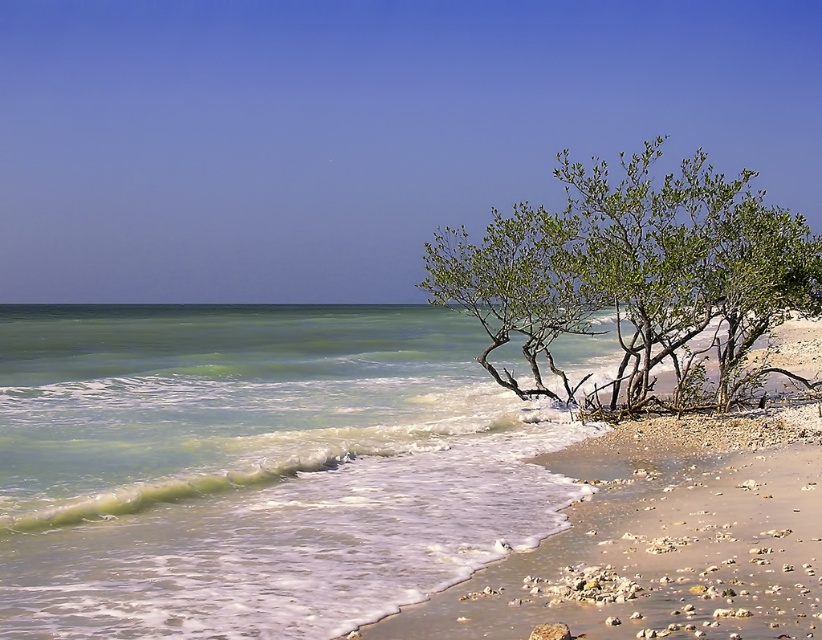
You are standing on the beach and want to place a buoy at the exact location of the green translucent water at lower left. What are the coordinates where you should place the buoy?

The coordinates for the green translucent water at lower left are at point (254,467), so you should place the buoy there.

You are standing on the beach and want to take a photo of the green leafy shrub at right without the green translucent water at lower left blocking the view. Which direction should you move to ensure the shrub is visible without the water in the frame?

Move to the right side of the green leafy shrub at right so that the green translucent water at lower left is no longer in front of it.